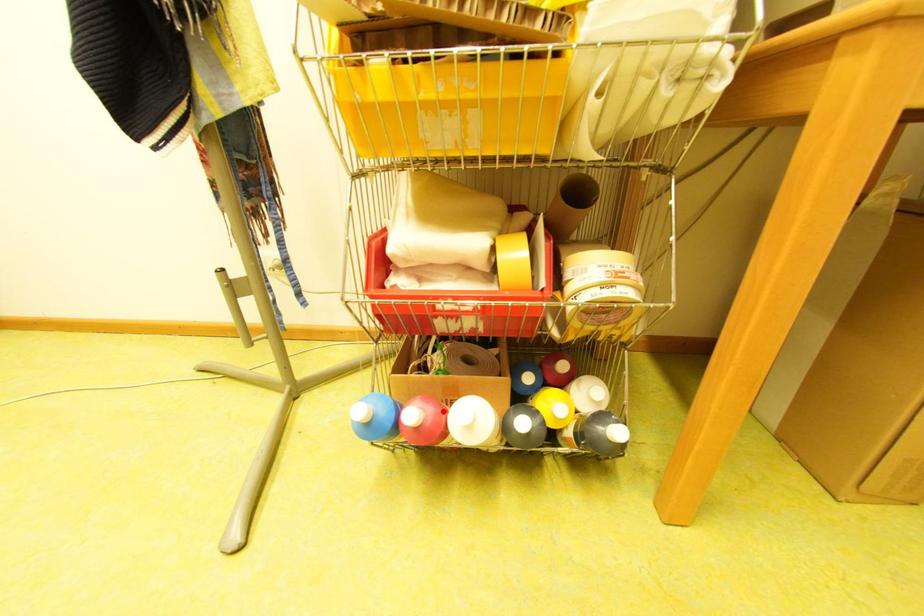
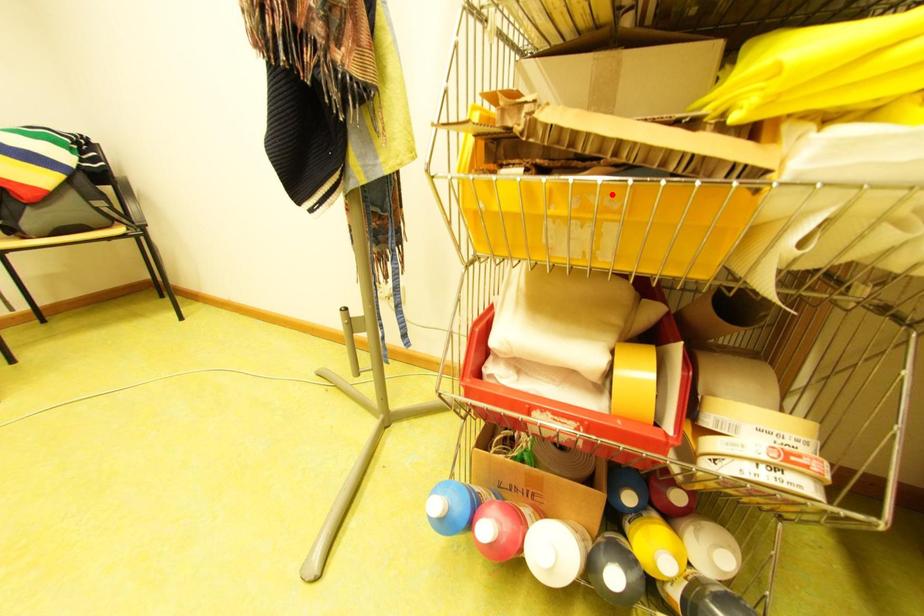
I am providing you with two images of the same scene from different viewpoints. A red point is marked on the first image and another point is marked on the second image. Do the highlighted points in image1 and image2 indicate the same real-world spot?

No